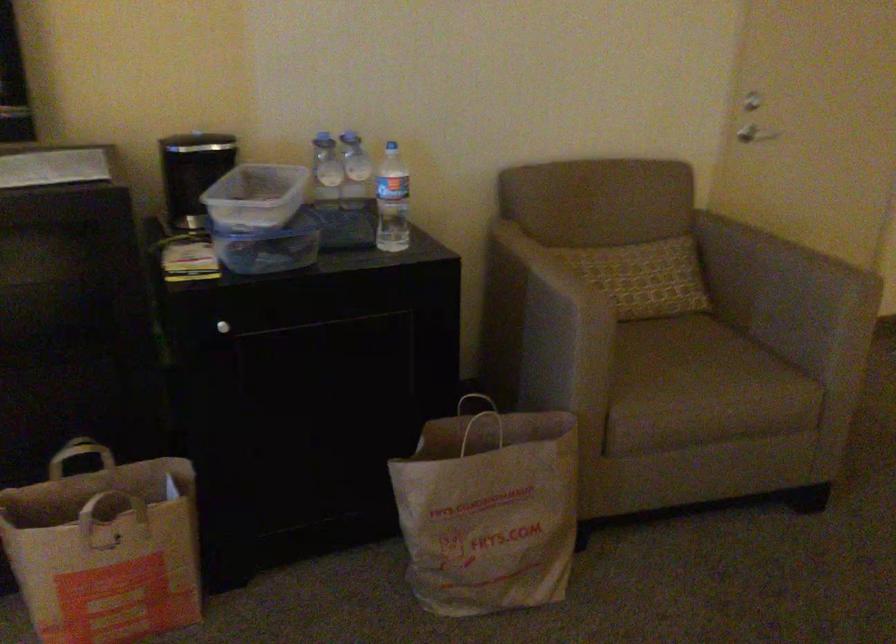
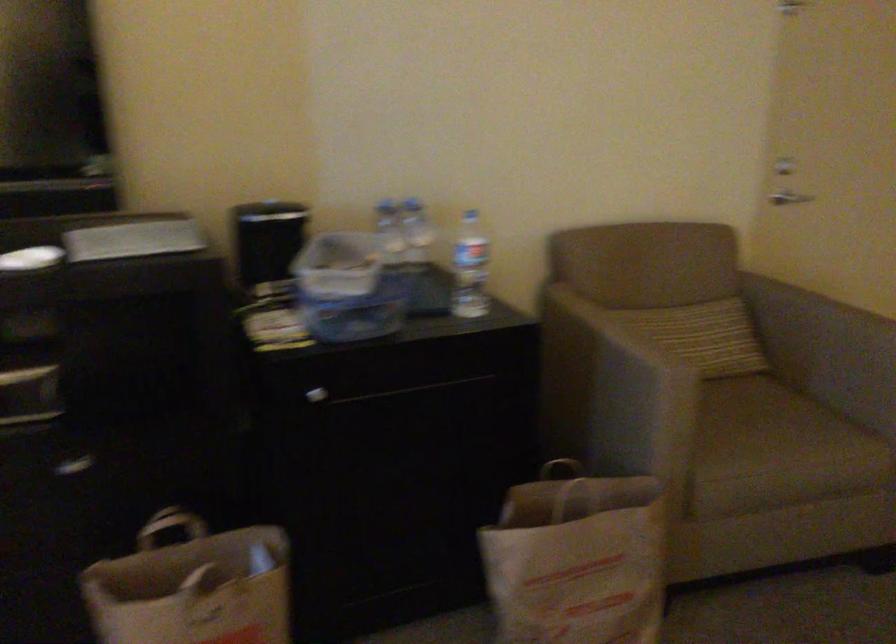
The point at (105, 480) is marked in the first image. Where is the corresponding point in the second image?

(192, 554)